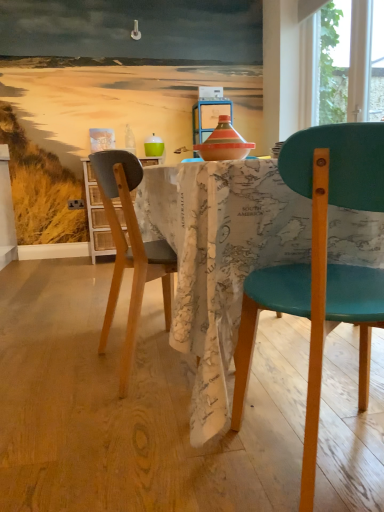
Where is `free space in front of matte black chair at center, the 1th chair viewed from the back`? free space in front of matte black chair at center, the 1th chair viewed from the back is located at coordinates (115, 432).